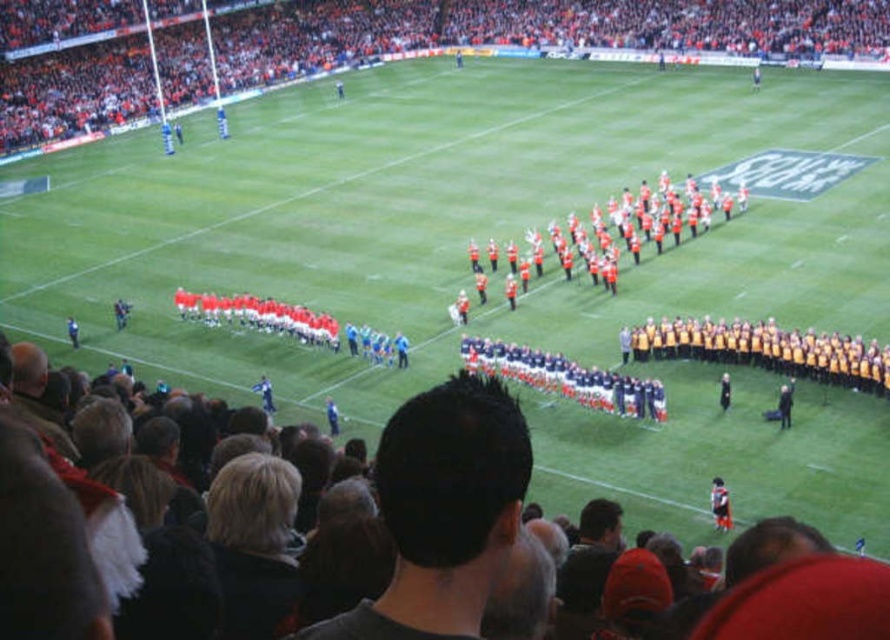
You are a photographer at the stadium and want to capture a photo that includes both the orange fabric crowd at upper left and the dark hair at center. Which object should you focus on first to ensure both are in the frame?

You should focus on the orange fabric crowd at upper left first because it is larger in size compared to the dark hair at center, ensuring it fits within the frame while also capturing the smaller dark hair at center.